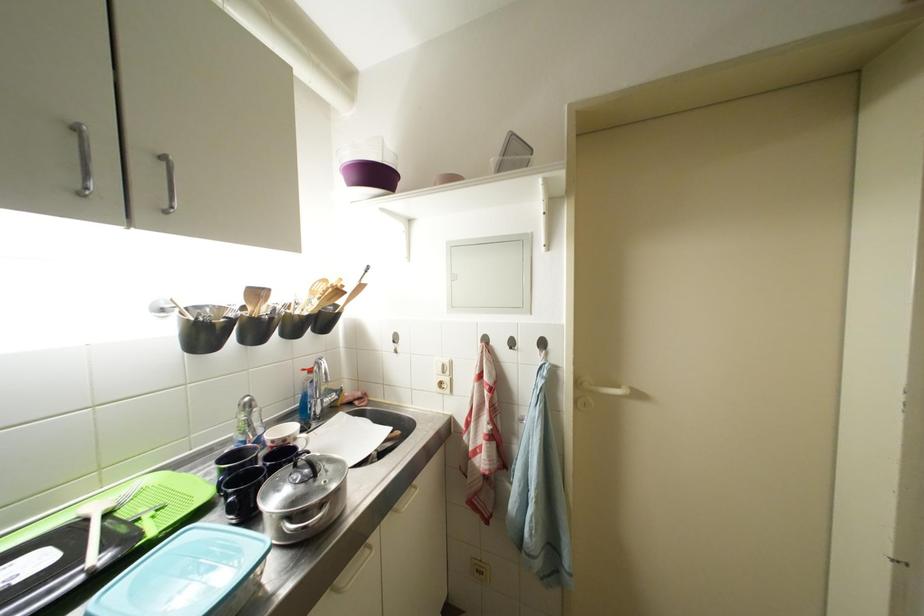
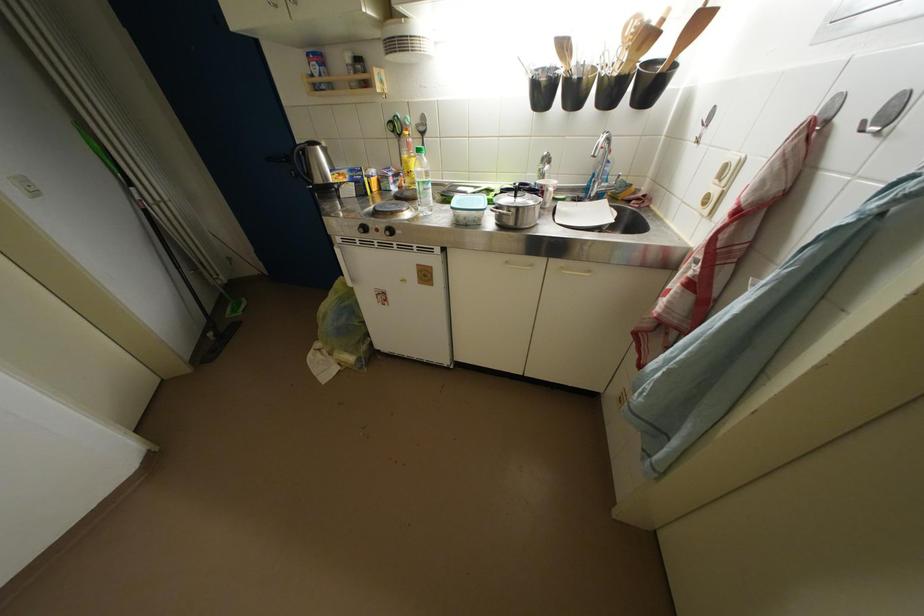
In the second image, find the point that corresponds to (x=517, y=353) in the first image.

(869, 132)